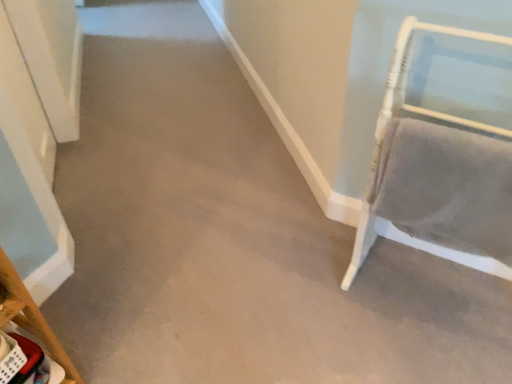
Locate an element on the screen. The image size is (512, 384). wooden chair at lower left, the 1th furniture in the left-to-right sequence is located at coordinates (31, 318).

The height and width of the screenshot is (384, 512). What do you see at coordinates (31, 318) in the screenshot?
I see `wooden chair at lower left, the second furniture positioned from the right` at bounding box center [31, 318].

At what (x,y) coordinates should I click in order to perform the action: click on velvet gray chair at right, which is the second furniture in left-to-right order. Please return your answer as a coordinate pair (x, y). The image size is (512, 384). Looking at the image, I should click on (443, 144).

This screenshot has height=384, width=512. What do you see at coordinates (443, 144) in the screenshot?
I see `velvet gray chair at right, which is the second furniture in left-to-right order` at bounding box center [443, 144].

Find the location of a particular element. The image size is (512, 384). wooden chair at lower left, the 1th furniture in the left-to-right sequence is located at coordinates (31, 318).

Is velvet gray chair at right, acting as the first furniture starting from the right, to the right of wooden chair at lower left, the 1th furniture in the left-to-right sequence, from the viewer's perspective?

Correct, you'll find velvet gray chair at right, acting as the first furniture starting from the right, to the right of wooden chair at lower left, the 1th furniture in the left-to-right sequence.

In the image, is velvet gray chair at right, which is the second furniture in left-to-right order, positioned in front of or behind wooden chair at lower left, the 1th furniture in the left-to-right sequence?

Visually, velvet gray chair at right, which is the second furniture in left-to-right order, is located in front of wooden chair at lower left, the 1th furniture in the left-to-right sequence.

Does point (431, 53) come closer to viewer compared to point (32, 299)?

Yes.

From the image's perspective, does velvet gray chair at right, acting as the first furniture starting from the right, appear lower than wooden chair at lower left, the 1th furniture in the left-to-right sequence?

No, from the image's perspective, velvet gray chair at right, acting as the first furniture starting from the right, is not below wooden chair at lower left, the 1th furniture in the left-to-right sequence.

From a real-world perspective, is velvet gray chair at right, which is the second furniture in left-to-right order, physically located above or below wooden chair at lower left, the 1th furniture in the left-to-right sequence?

In terms of real-world spatial position, velvet gray chair at right, which is the second furniture in left-to-right order, is above wooden chair at lower left, the 1th furniture in the left-to-right sequence.

Consider the image. Is velvet gray chair at right, acting as the first furniture starting from the right, thinner than wooden chair at lower left, the 1th furniture in the left-to-right sequence?

Incorrect, the width of velvet gray chair at right, acting as the first furniture starting from the right, is not less than that of wooden chair at lower left, the 1th furniture in the left-to-right sequence.

Does velvet gray chair at right, which is the second furniture in left-to-right order, have a greater height compared to wooden chair at lower left, the second furniture positioned from the right?

Yes, velvet gray chair at right, which is the second furniture in left-to-right order, is taller than wooden chair at lower left, the second furniture positioned from the right.

Consider the image. Is velvet gray chair at right, acting as the first furniture starting from the right, smaller than wooden chair at lower left, the second furniture positioned from the right?

Incorrect, velvet gray chair at right, acting as the first furniture starting from the right, is not smaller in size than wooden chair at lower left, the second furniture positioned from the right.

Do you think velvet gray chair at right, which is the second furniture in left-to-right order, is within wooden chair at lower left, the second furniture positioned from the right, or outside of it?

velvet gray chair at right, which is the second furniture in left-to-right order, is not inside wooden chair at lower left, the second furniture positioned from the right, it's outside.

Is velvet gray chair at right, which is the second furniture in left-to-right order, far from wooden chair at lower left, the 1th furniture in the left-to-right sequence?

Yes, velvet gray chair at right, which is the second furniture in left-to-right order, and wooden chair at lower left, the 1th furniture in the left-to-right sequence, are quite far apart.

Could you tell me if velvet gray chair at right, which is the second furniture in left-to-right order, is facing wooden chair at lower left, the second furniture positioned from the right?

No, velvet gray chair at right, which is the second furniture in left-to-right order, does not turn towards wooden chair at lower left, the second furniture positioned from the right.

What's the angular difference between velvet gray chair at right, acting as the first furniture starting from the right, and wooden chair at lower left, the 1th furniture in the left-to-right sequence,'s facing directions?

The angle between the facing direction of velvet gray chair at right, acting as the first furniture starting from the right, and the facing direction of wooden chair at lower left, the 1th furniture in the left-to-right sequence, is 92.1 degrees.

At what (x,y) coordinates should I click in order to perform the action: click on furniture that is below the velvet gray chair at right, which is the second furniture in left-to-right order (from the image's perspective). Please return your answer as a coordinate pair (x, y). This screenshot has height=384, width=512. Looking at the image, I should click on (31, 318).

Visually, is wooden chair at lower left, the second furniture positioned from the right, positioned to the left or to the right of velvet gray chair at right, acting as the first furniture starting from the right?

In the image, wooden chair at lower left, the second furniture positioned from the right, appears on the left side of velvet gray chair at right, acting as the first furniture starting from the right.

Based on the photo, between wooden chair at lower left, the 1th furniture in the left-to-right sequence, and velvet gray chair at right, acting as the first furniture starting from the right, which one is positioned in front?

velvet gray chair at right, acting as the first furniture starting from the right, is closer to the camera.

Which point is more distant from viewer, (x=12, y=310) or (x=411, y=68)?

The point (x=411, y=68) is farther from the camera.

From the image's perspective, would you say wooden chair at lower left, the 1th furniture in the left-to-right sequence, is shown under velvet gray chair at right, which is the second furniture in left-to-right order?

Indeed, from the image's perspective, wooden chair at lower left, the 1th furniture in the left-to-right sequence, is shown beneath velvet gray chair at right, which is the second furniture in left-to-right order.

Based on the photo, from a real-world perspective, which is physically below, wooden chair at lower left, the second furniture positioned from the right, or velvet gray chair at right, acting as the first furniture starting from the right?

wooden chair at lower left, the second furniture positioned from the right.

In terms of width, does wooden chair at lower left, the second furniture positioned from the right, look wider or thinner when compared to velvet gray chair at right, which is the second furniture in left-to-right order?

Considering their sizes, wooden chair at lower left, the second furniture positioned from the right, looks slimmer than velvet gray chair at right, which is the second furniture in left-to-right order.

Between wooden chair at lower left, the second furniture positioned from the right, and velvet gray chair at right, which is the second furniture in left-to-right order, which one has less height?

wooden chair at lower left, the second furniture positioned from the right.

Between wooden chair at lower left, the second furniture positioned from the right, and velvet gray chair at right, which is the second furniture in left-to-right order, which one has smaller size?

wooden chair at lower left, the second furniture positioned from the right.

Is wooden chair at lower left, the 1th furniture in the left-to-right sequence, outside of velvet gray chair at right, acting as the first furniture starting from the right?

Indeed, wooden chair at lower left, the 1th furniture in the left-to-right sequence, is completely outside velvet gray chair at right, acting as the first furniture starting from the right.

Would you consider wooden chair at lower left, the second furniture positioned from the right, to be distant from velvet gray chair at right, acting as the first furniture starting from the right?

Yes, wooden chair at lower left, the second furniture positioned from the right, is far from velvet gray chair at right, acting as the first furniture starting from the right.

Is wooden chair at lower left, the second furniture positioned from the right, facing away from velvet gray chair at right, acting as the first furniture starting from the right?

wooden chair at lower left, the second furniture positioned from the right, does not have its back to velvet gray chair at right, acting as the first furniture starting from the right.

How different are the orientations of wooden chair at lower left, the second furniture positioned from the right, and velvet gray chair at right, which is the second furniture in left-to-right order, in degrees?

They differ by 92.1 degrees in their facing directions.

Where is `furniture positioned vertically above the wooden chair at lower left, the 1th furniture in the left-to-right sequence (from a real-world perspective)`? furniture positioned vertically above the wooden chair at lower left, the 1th furniture in the left-to-right sequence (from a real-world perspective) is located at coordinates (443, 144).

The height and width of the screenshot is (384, 512). I want to click on furniture below the velvet gray chair at right, acting as the first furniture starting from the right (from a real-world perspective), so click(31, 318).

The height and width of the screenshot is (384, 512). In the image, there is a wooden chair at lower left, the second furniture positioned from the right. In order to click on furniture above it (from the image's perspective) in this screenshot , I will do `click(443, 144)`.